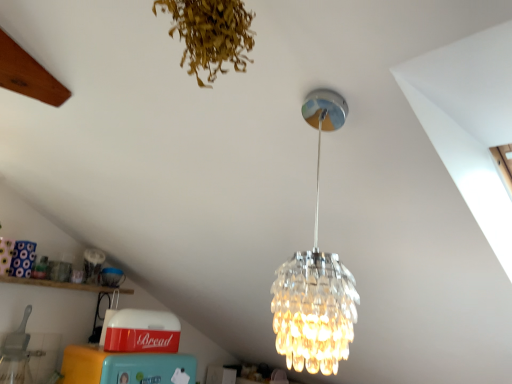
Question: Is wooden shelf at lower left to the right of brown dried leaves at upper center from the viewer's perspective?

Choices:
 (A) yes
 (B) no

Answer: (B)

Question: Is wooden shelf at lower left behind brown dried leaves at upper center?

Choices:
 (A) no
 (B) yes

Answer: (B)

Question: Is wooden shelf at lower left to the left of brown dried leaves at upper center from the viewer's perspective?

Choices:
 (A) yes
 (B) no

Answer: (A)

Question: From the image's perspective, is wooden shelf at lower left under brown dried leaves at upper center?

Choices:
 (A) yes
 (B) no

Answer: (A)

Question: Considering the relative sizes of wooden shelf at lower left and brown dried leaves at upper center in the image provided, is wooden shelf at lower left bigger than brown dried leaves at upper center?

Choices:
 (A) yes
 (B) no

Answer: (A)

Question: In the image, is clear glass chandelier at center on the left side or the right side of brown dried leaves at upper center?

Choices:
 (A) right
 (B) left

Answer: (A)

Question: Is clear glass chandelier at center wider or thinner than brown dried leaves at upper center?

Choices:
 (A) wide
 (B) thin

Answer: (A)

Question: Would you say clear glass chandelier at center is inside or outside brown dried leaves at upper center?

Choices:
 (A) outside
 (B) inside

Answer: (A)

Question: In the image, is clear glass chandelier at center positioned in front of or behind brown dried leaves at upper center?

Choices:
 (A) front
 (B) behind

Answer: (B)

Question: From the image's perspective, relative to wooden shelf at lower left, is brown dried leaves at upper center above or below?

Choices:
 (A) below
 (B) above

Answer: (B)

Question: Is brown dried leaves at upper center spatially inside wooden shelf at lower left, or outside of it?

Choices:
 (A) outside
 (B) inside

Answer: (A)

Question: Considering the positions of point (198, 69) and point (73, 286), is point (198, 69) closer or farther from the camera than point (73, 286)?

Choices:
 (A) closer
 (B) farther

Answer: (A)

Question: In terms of height, does brown dried leaves at upper center look taller or shorter compared to wooden shelf at lower left?

Choices:
 (A) tall
 (B) short

Answer: (A)

Question: Is wooden shelf at lower left situated inside clear glass chandelier at center or outside?

Choices:
 (A) inside
 (B) outside

Answer: (B)

Question: Does point (31, 278) appear closer or farther from the camera than point (309, 342)?

Choices:
 (A) farther
 (B) closer

Answer: (A)